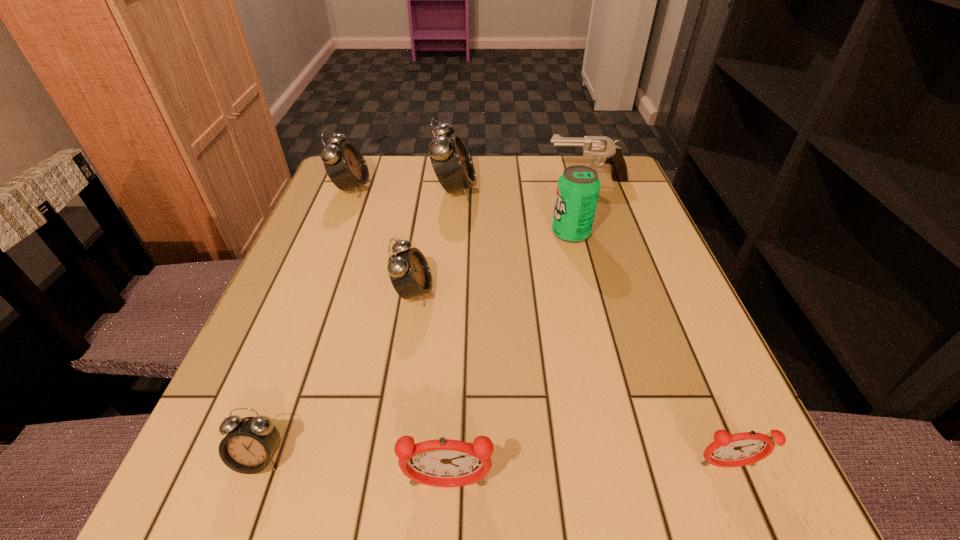
Where is `vacant space that satisfies the following two spatial constraints: 1. at the muzzle of the gun; 2. on the front-facing side of the left reddish-pink alarm clock`? This screenshot has width=960, height=540. vacant space that satisfies the following two spatial constraints: 1. at the muzzle of the gun; 2. on the front-facing side of the left reddish-pink alarm clock is located at coordinates [690, 485].